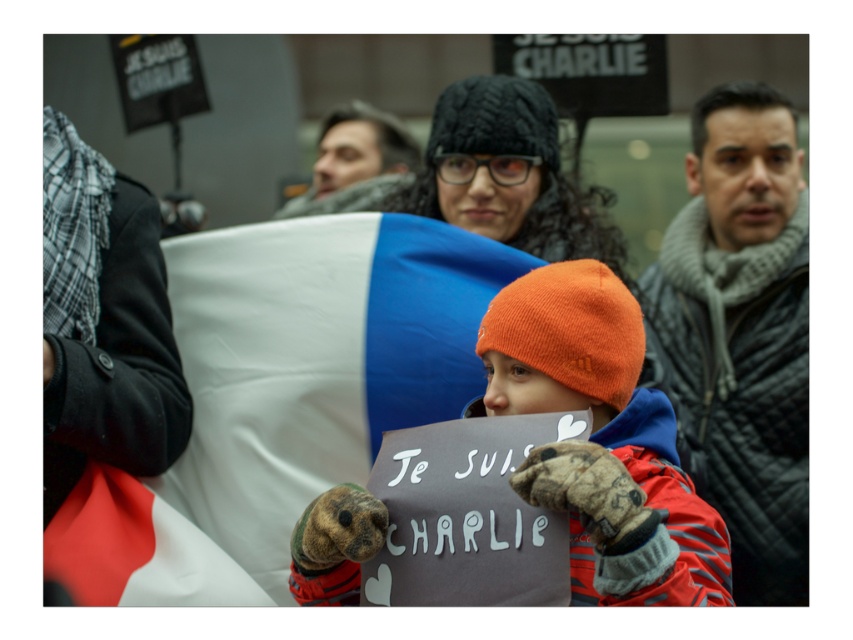
You are a photographer at the demonstration. You want to capture a clear photo of the white fabric flag at center without the gray quilted jacket at right blocking it. Is the flag currently positioned in a way that allows this?

The white fabric flag at center is in front of the gray quilted jacket at right, so yes, the flag is not blocked by the jacket and can be photographed clearly.

You are a photographer at the demonstration. You need to capture a photo that includes both the white fabric flag at center and the gray quilted jacket at right. Based on their positions, will the flag be visible in the photo if you focus on the jacket?

The white fabric flag at center is positioned under the gray quilted jacket at right, so if you focus on the jacket, the flag will still be visible below it in the photo.